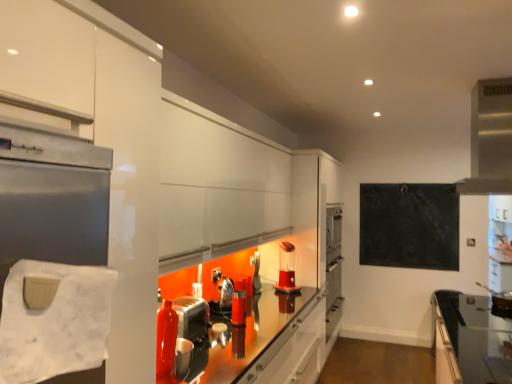
Question: From the image's perspective, is black glass countertop at lower right positioned above or below metallic silver toaster at center, acting as the first appliance starting from the back?

Choices:
 (A) below
 (B) above

Answer: (A)

Question: Is black glass countertop at lower right bigger or smaller than metallic silver toaster at center, acting as the first appliance starting from the back?

Choices:
 (A) small
 (B) big

Answer: (B)

Question: Based on their relative distances, which object is nearer to the white paper towel at left?

Choices:
 (A) black glass countertop at lower right
 (B) metallic silver toaster at center, which is the third appliance from front to back
 (C) translucent plastic coffee machine at center
 (D) satin silver exhaust hood at upper right
 (E) metallic silver toaster at center, arranged as the 3th appliance when viewed from the back

Answer: (E)

Question: Estimate the real-world distances between objects in this image. Which object is farther from the shiny metallic kettle at center, the second appliance viewed from the front?

Choices:
 (A) black slate board at upper right
 (B) metallic silver toaster at center, which appears as the 1th appliance when viewed from the front
 (C) black glass countertop at lower right
 (D) translucent plastic coffee machine at center
 (E) white paper towel at left

Answer: (A)